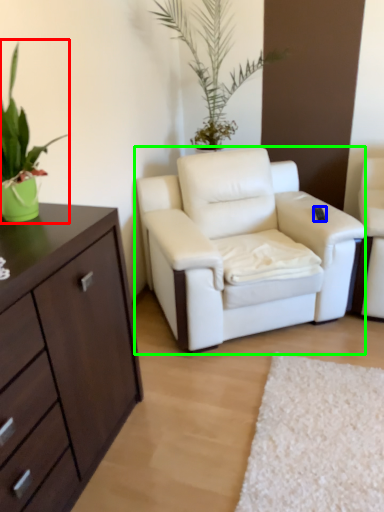
Question: Estimate the real-world distances between objects in this image. Which object is farther from houseplant (highlighted by a red box), remote control (highlighted by a blue box) or chair (highlighted by a green box)?

Choices:
 (A) remote control
 (B) chair

Answer: (A)